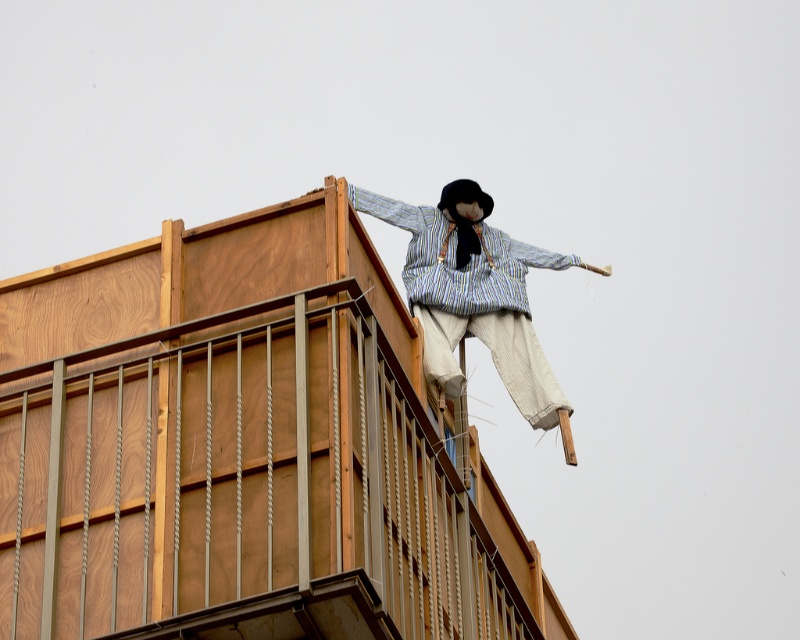
Question: Can you confirm if wooden at upper center is thinner than striped fabric scarecrow at upper center?

Choices:
 (A) yes
 (B) no

Answer: (B)

Question: Which point is closer to the camera taking this photo?

Choices:
 (A) (414, 580)
 (B) (526, 326)

Answer: (A)

Question: Does wooden at upper center appear over striped fabric scarecrow at upper center?

Choices:
 (A) no
 (B) yes

Answer: (A)

Question: Does wooden at upper center appear under striped fabric scarecrow at upper center?

Choices:
 (A) no
 (B) yes

Answer: (B)